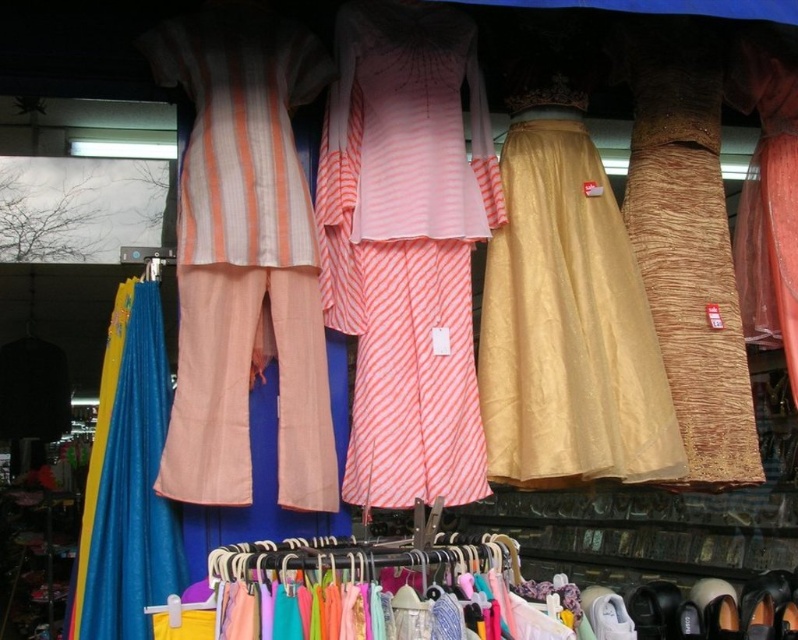
Question: Considering the real-world distances, which object is closest to the blue fabric at left?

Choices:
 (A) shiny brown shoe at lower right
 (B) gold satin dress at center
 (C) pink striped fabric dress at center

Answer: (C)

Question: Which object appears closest to the camera in this image?

Choices:
 (A) striped peach pants at left
 (B) shiny brown shoe at lower right
 (C) blue fabric at left
 (D) gold satin dress at center

Answer: (C)

Question: Does pink striped fabric dress at center have a smaller size compared to striped peach pants at left?

Choices:
 (A) no
 (B) yes

Answer: (B)

Question: Is pink striped fabric dress at center bigger than shiny brown shoe at lower right?

Choices:
 (A) yes
 (B) no

Answer: (A)

Question: Does blue fabric at left have a larger size compared to shiny brown shoe at lower right?

Choices:
 (A) yes
 (B) no

Answer: (A)

Question: Among these points, which one is farthest from the camera?

Choices:
 (A) (551, 198)
 (B) (394, 83)
 (C) (737, 604)
 (D) (219, 236)

Answer: (A)